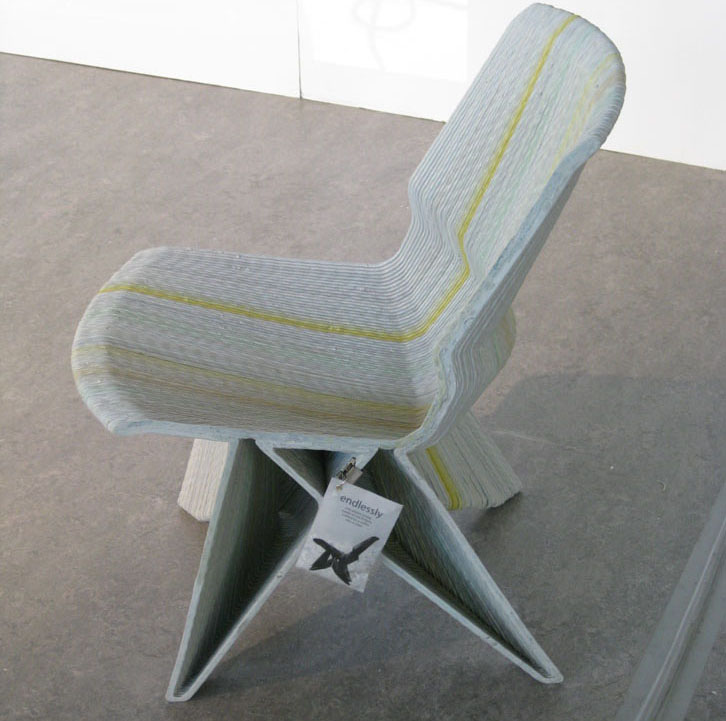
The image size is (726, 721). I want to click on metal slit in floor, so click(689, 636).